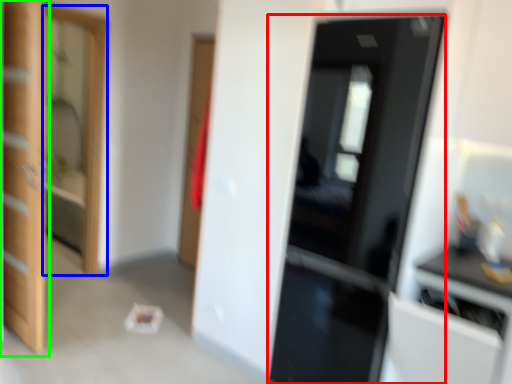
Question: Considering the real-world distances, which object is closest to door (highlighted by a red box)? screen door (highlighted by a blue box) or door (highlighted by a green box).

Choices:
 (A) screen door
 (B) door

Answer: (B)